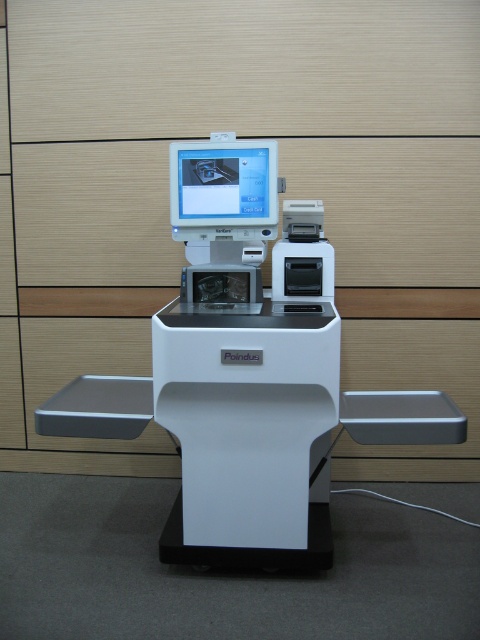
In the scene shown: Between white plastic machine at center and matte plastic monitor at center, which one is positioned lower?

white plastic machine at center is lower down.

Is white plastic machine at center shorter than matte plastic monitor at center?

→ In fact, white plastic machine at center may be taller than matte plastic monitor at center.

You are a GUI agent. You are given a task and a screenshot of the screen. Output one action in this format:
    pyautogui.click(x=<x>, y=<y>)
    Task: Click on the white plastic machine at center
    This screenshot has height=640, width=480.
    Given the screenshot: What is the action you would take?
    (248, 372)

I want to click on white plastic machine at center, so click(x=248, y=372).